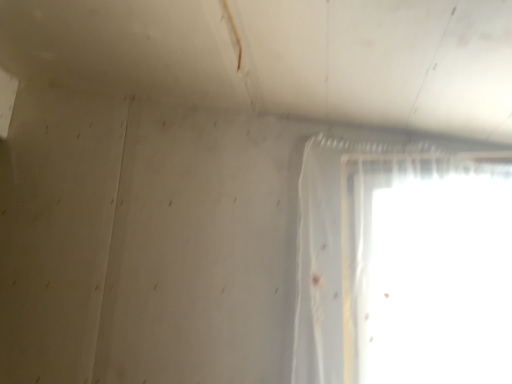
Locate an element on the screen. This screenshot has height=384, width=512. transparent fabric curtain at right is located at coordinates (403, 264).

Describe the element at coordinates (403, 264) in the screenshot. I see `transparent fabric curtain at right` at that location.

I want to click on transparent fabric curtain at right, so click(x=403, y=264).